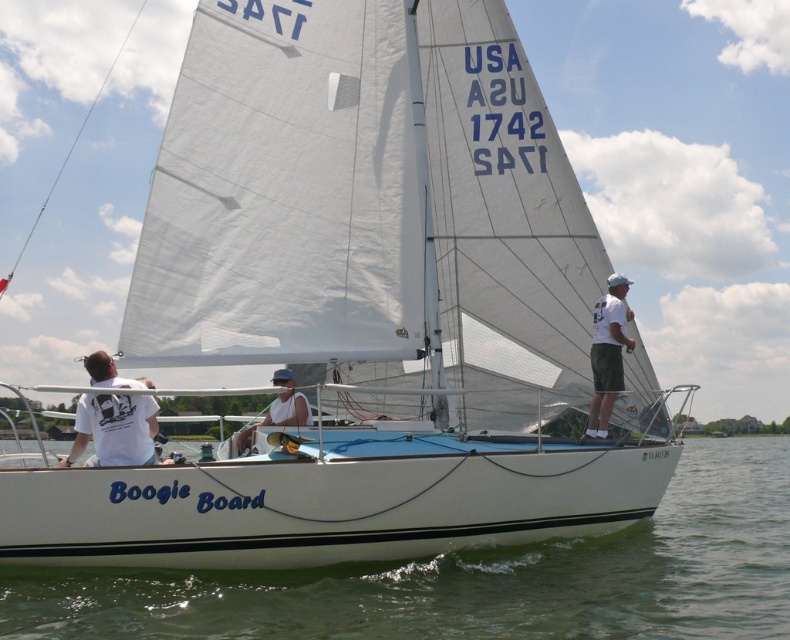
Can you confirm if white water at center is shorter than white matte shirt at upper right?

Yes, white water at center is shorter than white matte shirt at upper right.

Which is in front, point (768, 604) or point (626, 321)?

Point (768, 604) is in front.

The height and width of the screenshot is (640, 790). I want to click on white water at center, so click(478, 579).

Between point (104, 440) and point (125, 380), which one is positioned behind?

Point (125, 380)

Is white matte sunglasses at center behind white matte t-shirt at lower left?

Yes.

This screenshot has height=640, width=790. Describe the element at coordinates (115, 429) in the screenshot. I see `white matte sunglasses at center` at that location.

Locate an element on the screen. white matte sunglasses at center is located at coordinates (115, 429).

Is white matte sunglasses at center to the right of white matte tank top at center from the viewer's perspective?

Indeed, white matte sunglasses at center is positioned on the right side of white matte tank top at center.

Between white matte sunglasses at center and white matte tank top at center, which one is positioned lower?

white matte tank top at center is below.

What do you see at coordinates (115, 429) in the screenshot? The width and height of the screenshot is (790, 640). I see `white matte sunglasses at center` at bounding box center [115, 429].

The height and width of the screenshot is (640, 790). What are the coordinates of `white matte sunglasses at center` in the screenshot? It's located at (115, 429).